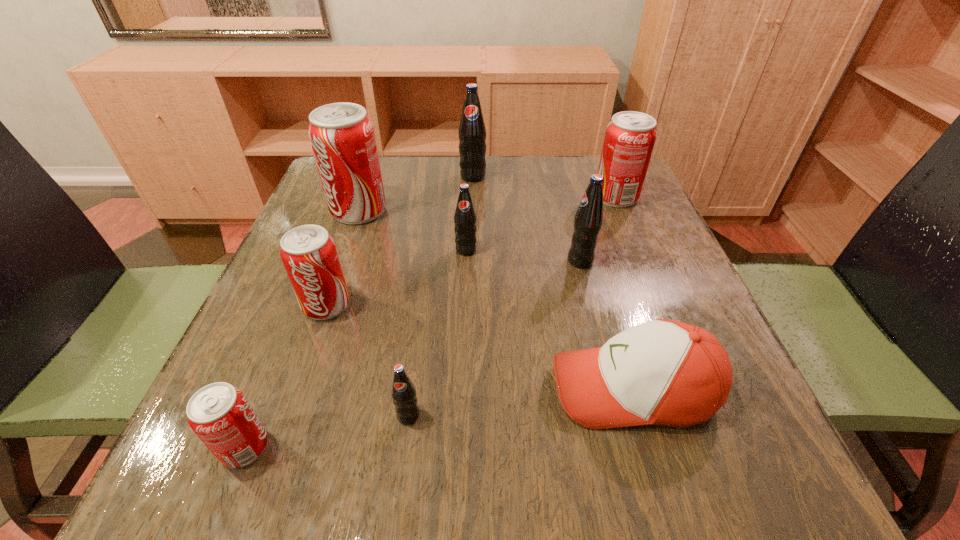
This screenshot has width=960, height=540. In order to click on orange baseball cap in this screenshot , I will do `click(664, 372)`.

You are a GUI agent. You are given a task and a screenshot of the screen. Output one action in this format:
    pyautogui.click(x=<x>, y=<y>)
    Task: Click on the leftmost black pop
    The image size is (960, 540).
    Given the screenshot: What is the action you would take?
    pyautogui.click(x=403, y=392)

Where is `the nearest black pop`? The width and height of the screenshot is (960, 540). the nearest black pop is located at coordinates 403,392.

The image size is (960, 540). What are the coordinates of `the nearest red soda can` in the screenshot? It's located at (220, 415).

Locate an element on the screen. This screenshot has width=960, height=540. free space located 0.280m on the front label of the farthest object is located at coordinates (471, 254).

Locate an element on the screen. The image size is (960, 540). vacant space located 0.260m on the right of the biggest red soda can is located at coordinates (497, 210).

Find the location of `free space located 0.400m on the left of the second biggest red soda can`. free space located 0.400m on the left of the second biggest red soda can is located at coordinates (430, 197).

Find the location of a particular element. free spot located 0.150m on the front label of the second soda can from right to left is located at coordinates (494, 261).

The height and width of the screenshot is (540, 960). What are the coordinates of `vacant space located 0.300m on the front label of the second soda can from right to left` in the screenshot? It's located at (x=420, y=261).

At what (x,y) coordinates should I click in order to perform the action: click on vacant area situated 0.390m on the front label of the second soda can from right to left. Please return your answer as a coordinate pair (x, y). The height and width of the screenshot is (540, 960). Looking at the image, I should click on (377, 261).